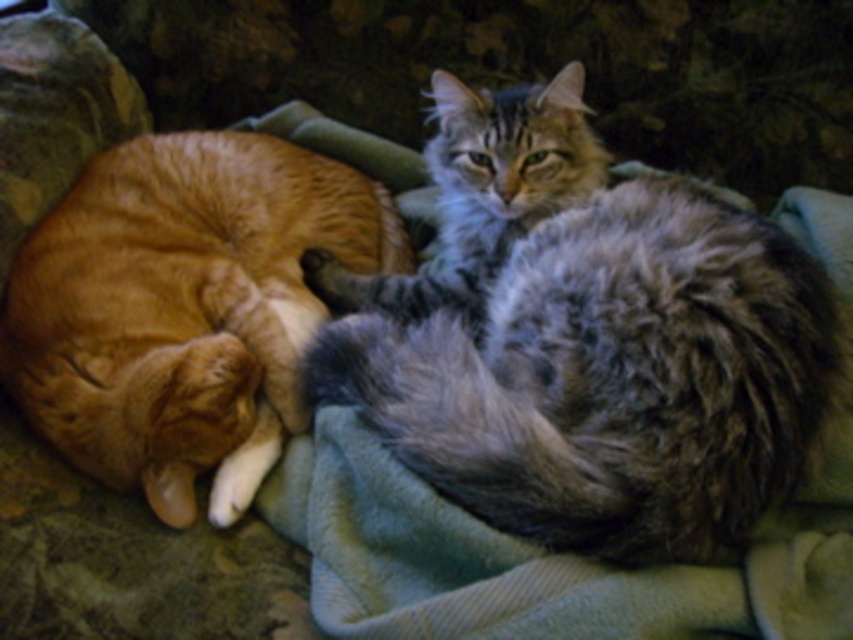
You are a photographer trying to capture a clear photo of both the gray fluffy cat at center and the orange fur cat at left. Since you want to focus on the taller cat first, which one should you adjust your camera settings for?

The gray fluffy cat at center is much taller than the orange fur cat at left, so you should adjust your camera settings for the gray fluffy cat at center first.

You are a photographer positioned at the origin point. You want to capture both cats in a single shot. Given that the orange cat with white paws is at the lower left and the gray fluffy cat at center is at point 0.534, 0.688, which cat is closer to the camera?

The gray fluffy cat at center is located at point (585, 340), which is closer to the camera compared to the orange cat with white paws at the lower left position.